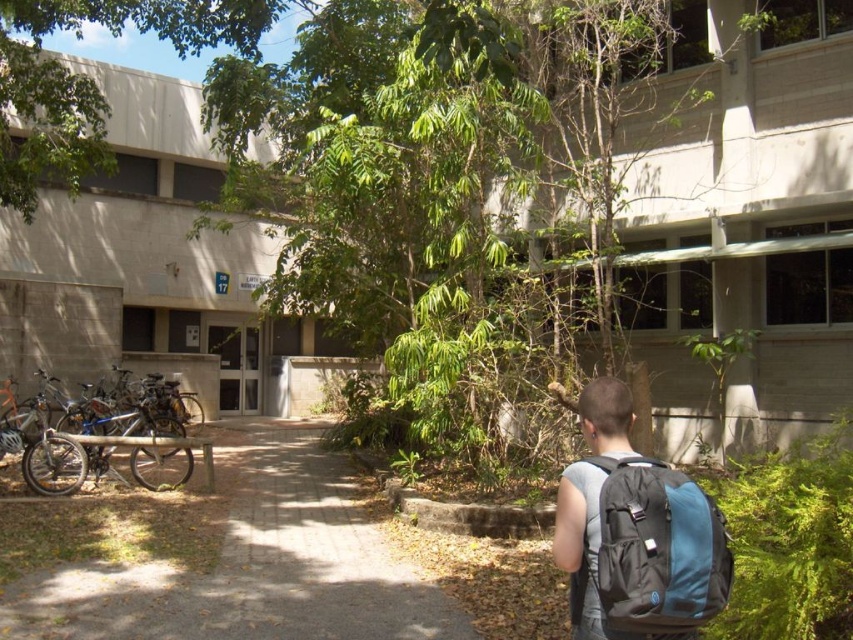
Question: Can you confirm if green leafy tree at upper center is positioned above silver metallic bicycle at left?

Choices:
 (A) yes
 (B) no

Answer: (A)

Question: Is brick paved path at center wider than teal fabric backpack at lower right?

Choices:
 (A) yes
 (B) no

Answer: (A)

Question: Is brick paved path at center to the right of teal fabric backpack at lower right from the viewer's perspective?

Choices:
 (A) yes
 (B) no

Answer: (B)

Question: Which point is closer to the camera?

Choices:
 (A) click(184, 476)
 (B) click(653, 570)
 (C) click(222, 44)

Answer: (B)

Question: Which point is farther from the camera taking this photo?

Choices:
 (A) (146, 428)
 (B) (668, 577)
 (C) (183, 52)
 (D) (370, 637)

Answer: (C)

Question: Which is farther from the teal fabric backpack at lower right?

Choices:
 (A) brick paved path at center
 (B) silver metallic bicycle at left
 (C) green leafy tree at upper center

Answer: (C)